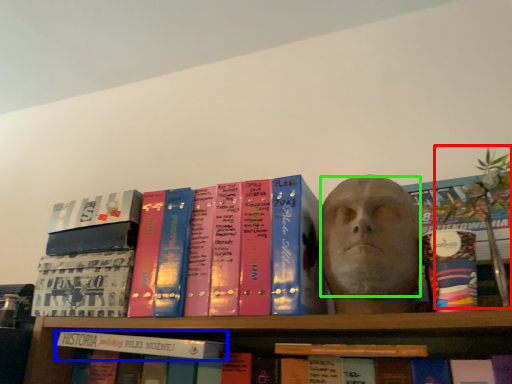
Question: Which object is positioned farthest from plant (highlighted by a red box)? Select from book (highlighted by a blue box) and human face (highlighted by a green box).

Choices:
 (A) book
 (B) human face

Answer: (A)